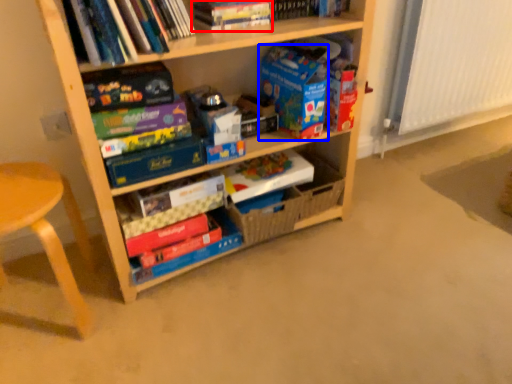
Question: Which of the following is the farthest to the observer, book (highlighted by a red box) or paperback book (highlighted by a blue box)?

Choices:
 (A) book
 (B) paperback book

Answer: (B)